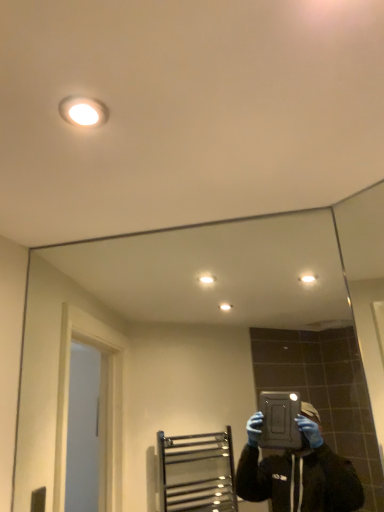
Question: In the image, is clear glass mirror at center positioned in front of or behind white glossy light fixture at upper center?

Choices:
 (A) front
 (B) behind

Answer: (B)

Question: Is clear glass mirror at center inside or outside of white glossy light fixture at upper center?

Choices:
 (A) inside
 (B) outside

Answer: (B)

Question: Looking at the image, does clear glass mirror at center seem bigger or smaller compared to white glossy light fixture at upper center?

Choices:
 (A) small
 (B) big

Answer: (B)

Question: Does point (89, 99) appear closer or farther from the camera than point (248, 339)?

Choices:
 (A) farther
 (B) closer

Answer: (B)

Question: From the image's perspective, is white glossy light fixture at upper center positioned above or below clear glass mirror at center?

Choices:
 (A) above
 (B) below

Answer: (A)

Question: Which is correct: white glossy light fixture at upper center is inside clear glass mirror at center, or outside of it?

Choices:
 (A) inside
 (B) outside

Answer: (B)

Question: Is white glossy light fixture at upper center taller or shorter than clear glass mirror at center?

Choices:
 (A) tall
 (B) short

Answer: (B)